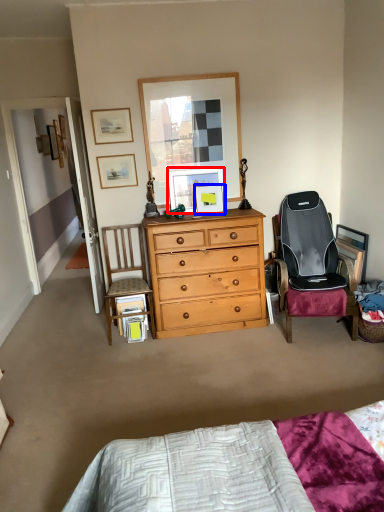
Question: Which point is further to the camera, picture frame (highlighted by a red box) or picture frame (highlighted by a blue box)?

Choices:
 (A) picture frame
 (B) picture frame

Answer: (B)